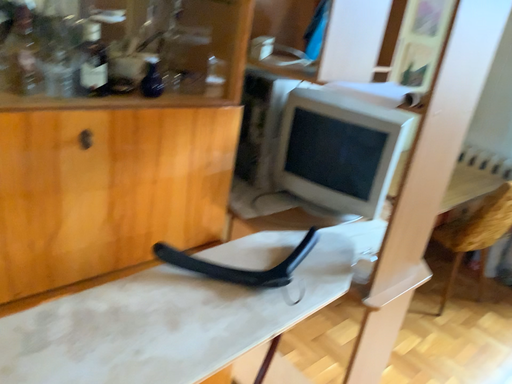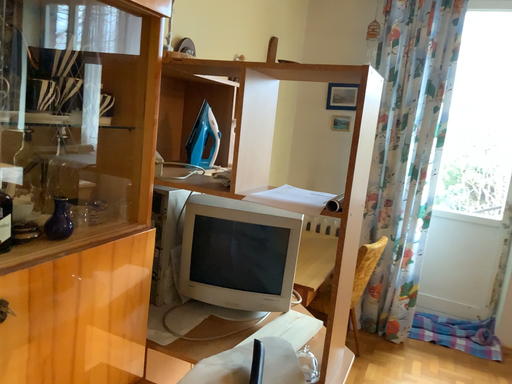
Question: Which way did the camera rotate in the video?

Choices:
 (A) rotated left
 (B) rotated right

Answer: (B)